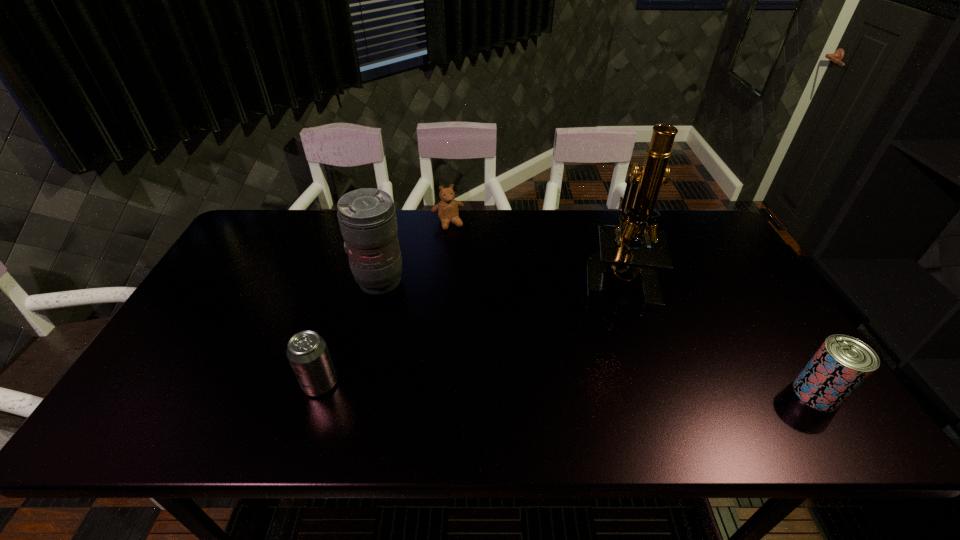
This screenshot has width=960, height=540. I want to click on object that is positioned at the right edge, so click(x=841, y=365).

This screenshot has height=540, width=960. I want to click on object positioned at the near right corner, so pos(841,365).

Identify the location of free point at the far edge. The image size is (960, 540). (424, 224).

In the image, there is a desktop. Where is `vacant space at the near edge`? Image resolution: width=960 pixels, height=540 pixels. vacant space at the near edge is located at coordinates (378, 370).

Locate an element on the screen. vacant space at the left edge is located at coordinates (195, 306).

Locate an element on the screen. The width and height of the screenshot is (960, 540). blank space at the right edge is located at coordinates (713, 284).

Where is `vacant region at the far right corner of the desktop`? The height and width of the screenshot is (540, 960). vacant region at the far right corner of the desktop is located at coordinates (708, 239).

What are the coordinates of `vacant space that's between the third object from right to left and the second object from right to left` in the screenshot? It's located at 532,249.

Identify the location of free point between the right beer can and the fourth shortest object. The image size is (960, 540). (598, 338).

This screenshot has width=960, height=540. Find the location of `free space between the rightmost object and the fourth object from left to right`. free space between the rightmost object and the fourth object from left to right is located at coordinates (716, 335).